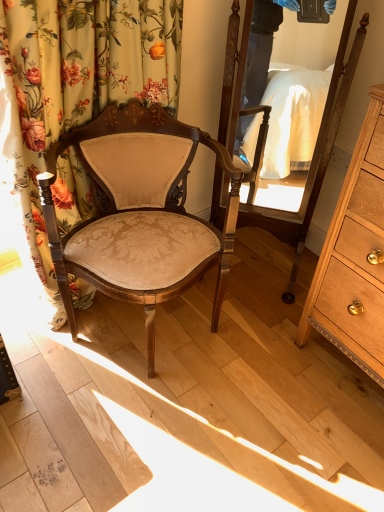
Locate an element on the screen. This screenshot has width=384, height=512. free space to the left of light brown wood dresser at right is located at coordinates (272, 372).